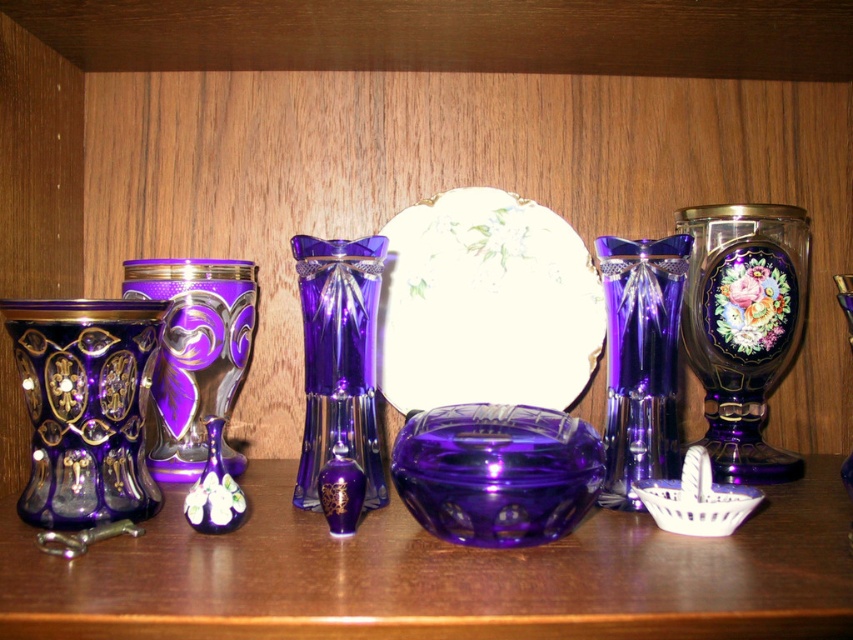
Question: Is matte purple glass vase at left smaller than matte purple vase at right?

Choices:
 (A) yes
 (B) no

Answer: (A)

Question: Does purple glass vase at center lie in front of transparent purple vase at center?

Choices:
 (A) no
 (B) yes

Answer: (A)

Question: Which object is closer to the camera taking this photo?

Choices:
 (A) transparent purple bowl at center
 (B) matte purple glass vase at left
 (C) matte purple vase at center

Answer: (A)

Question: Is matte purple glass vase at center to the left of matte purple vase at center from the viewer's perspective?

Choices:
 (A) no
 (B) yes

Answer: (A)

Question: Estimate the real-world distances between objects in this image. Which object is closer to the matte purple vase at right?

Choices:
 (A) matte purple glass vase at center
 (B) transparent purple vase at center

Answer: (B)

Question: Which point is closer to the camera taking this photo?

Choices:
 (A) (846, 480)
 (B) (204, 323)

Answer: (A)